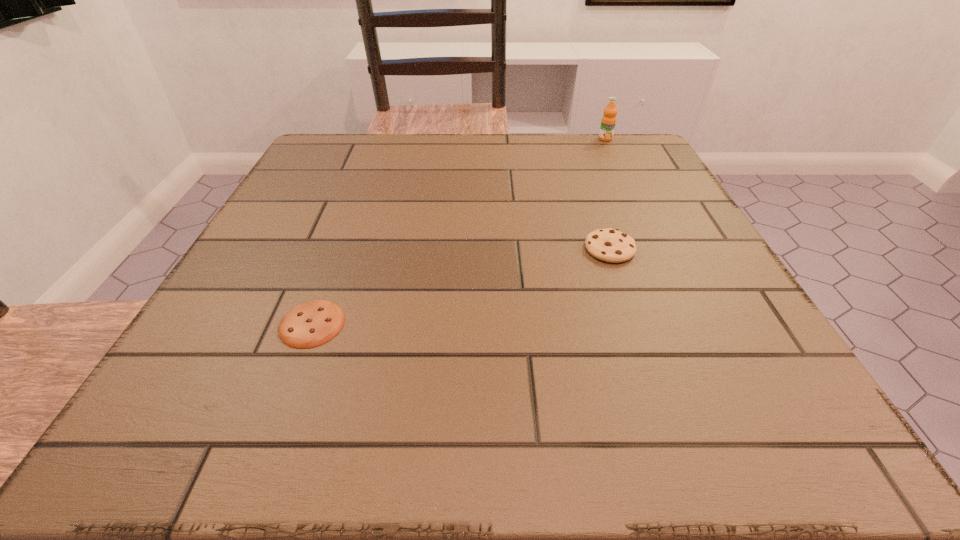
Where is `vacant space at the far right corner of the desktop`? The height and width of the screenshot is (540, 960). vacant space at the far right corner of the desktop is located at coordinates (644, 152).

Locate an element on the screen. vacant space in between the left cookie and the second farthest object is located at coordinates (461, 286).

Find the location of a particular element. vacant area that lies between the leftmost object and the farthest object is located at coordinates (459, 231).

Locate an element on the screen. The height and width of the screenshot is (540, 960). unoccupied area between the leftmost object and the tallest object is located at coordinates (459, 231).

Where is `vacant area that lies between the shorter cookie and the second nearest object`? The height and width of the screenshot is (540, 960). vacant area that lies between the shorter cookie and the second nearest object is located at coordinates (461, 286).

Identify the location of vacant space in between the farthest object and the second object from left to right. (608, 194).

The height and width of the screenshot is (540, 960). Identify the location of vacant area between the second object from right to left and the left cookie. (461, 286).

Locate an element on the screen. free space between the nearer cookie and the second object from right to left is located at coordinates (461, 286).

The height and width of the screenshot is (540, 960). I want to click on blank region between the farthest object and the nearer cookie, so click(x=459, y=231).

At what (x,y) coordinates should I click in order to perform the action: click on vacant area that lies between the rightmost object and the taller cookie. Please return your answer as a coordinate pair (x, y). The image size is (960, 540). Looking at the image, I should click on (608, 194).